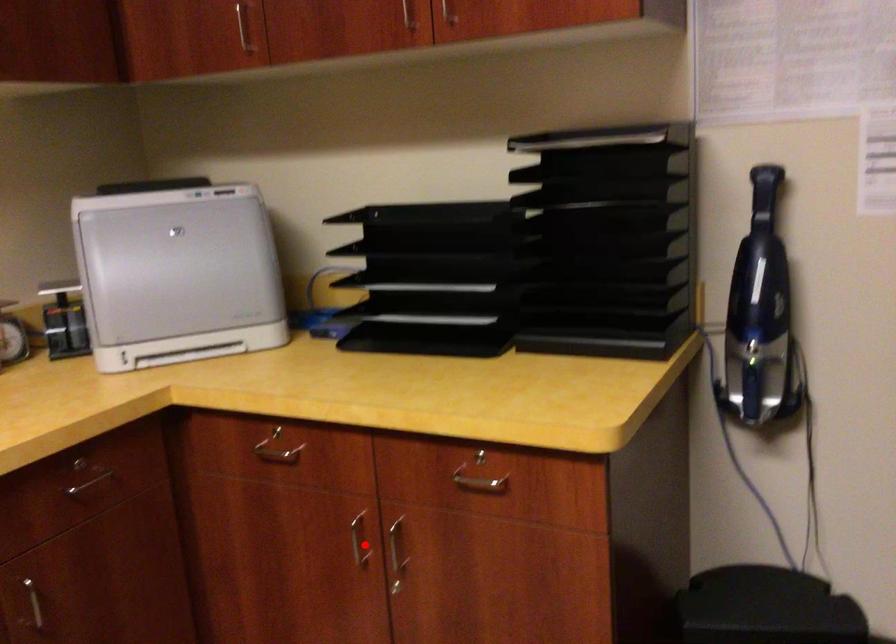
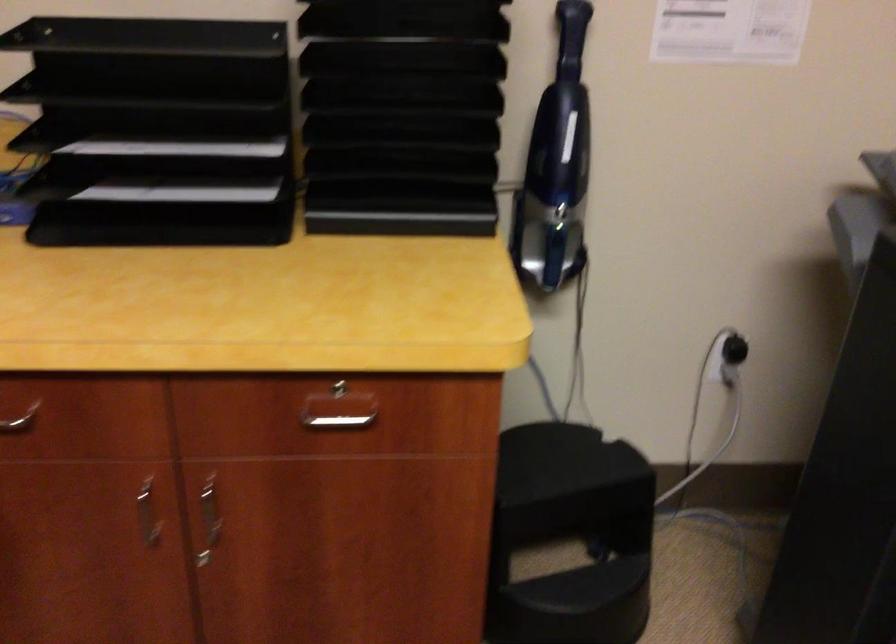
In the second image, find the point that corresponds to the highlighted location in the first image.

(148, 514)